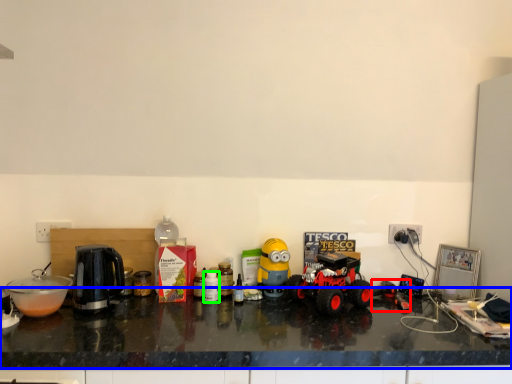
Question: Which object is the farthest from toy (highlighted by a red box)? Choose among these: countertop (highlighted by a blue box) or bottle (highlighted by a green box).

Choices:
 (A) countertop
 (B) bottle

Answer: (B)